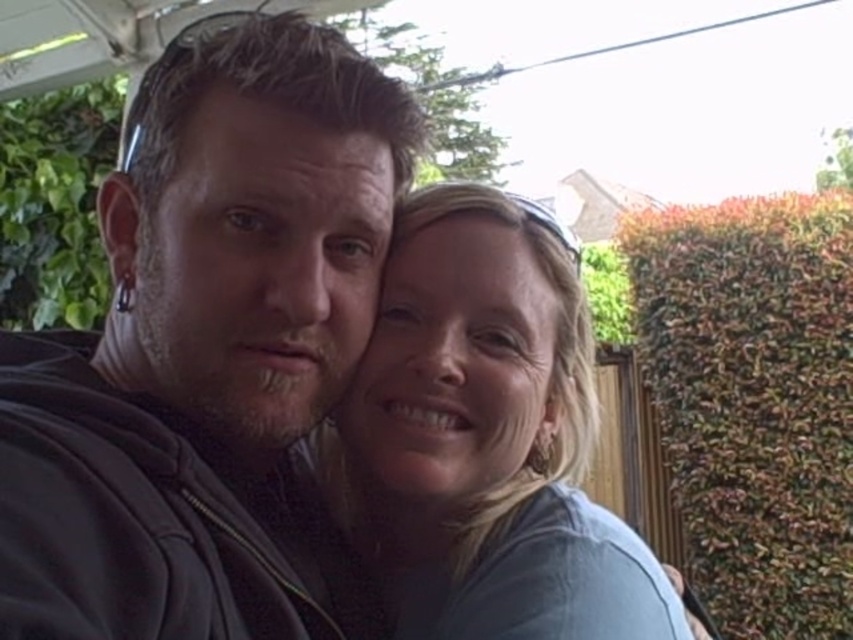
You are a photographer adjusting the lighting for a photo shoot. You notice the leather jacket at center and the light blue fabric at center in the frame. Which object should you adjust the lighting for if you want to ensure the one that is higher up in the image is properly illuminated?

The leather jacket at center is above the light blue fabric at center, so you should adjust the lighting for the leather jacket at center to ensure it is properly illuminated.

You are holding a 24 inch ruler and want to measure the distance between yourself and the point marked at coordinates (303, 19) in the image. Can you determine if the ruler will be sufficient to measure this distance?

The distance between you and the point marked at coordinates (303, 19) is 24.87 inches. Since the ruler is only 24 inches long, it is slightly shorter than the required distance, so it will not be sufficient to measure the entire length in one go.

Based on the photo, you are taking a photo of two people standing under a white roof. You notice the leather jacket at center and the light blue fabric at center. Which one is more to the left?

The leather jacket at center is positioned on the left side of light blue fabric at center, so it is more to the left.